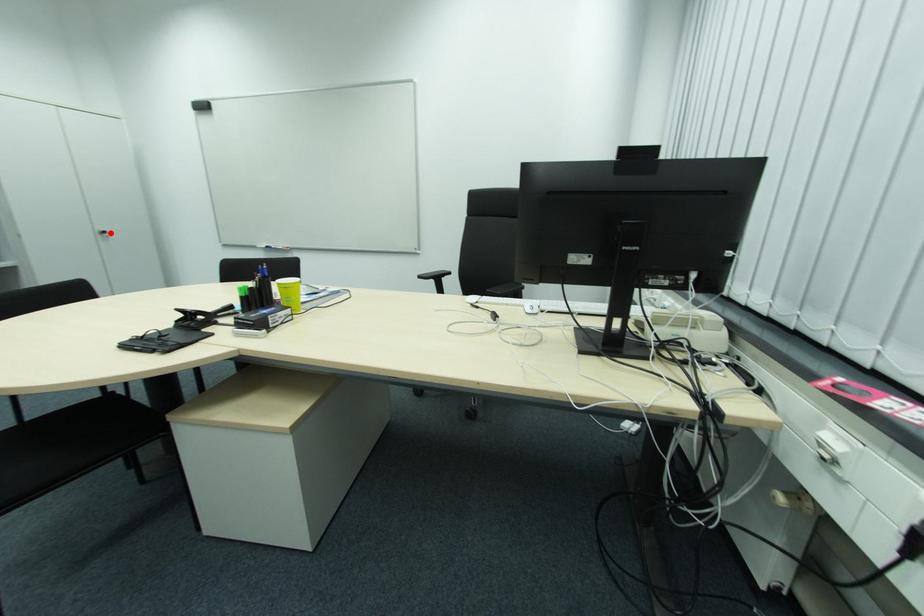
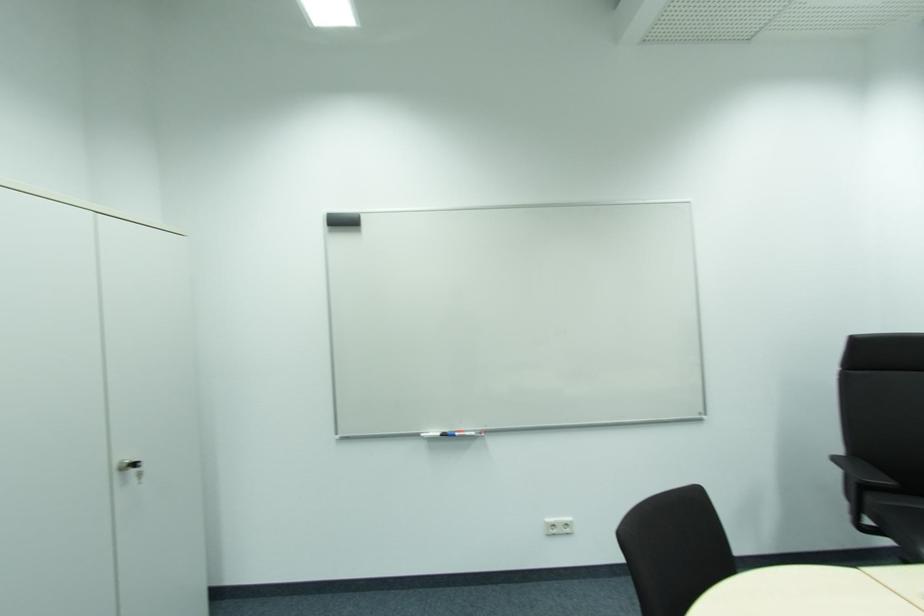
In the second image, find the point that corresponds to the highlighted location in the first image.

(140, 464)